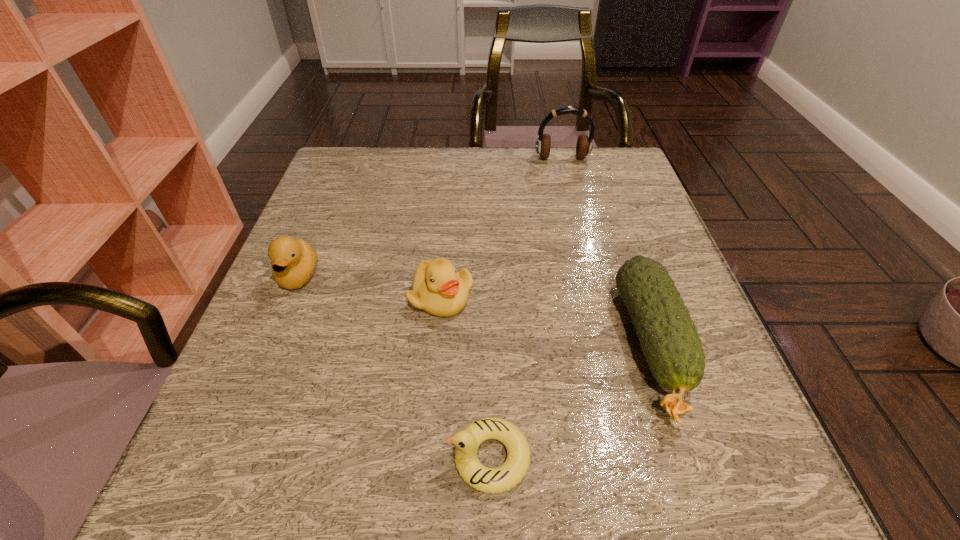
Where is `vacant space that is in between the tallest object and the leftmost object`? vacant space that is in between the tallest object and the leftmost object is located at coordinates (431, 218).

Image resolution: width=960 pixels, height=540 pixels. In order to click on object that is the fourth nearest to the cucumber in this screenshot , I will do `click(293, 261)`.

Locate which object ranks third in proximity to the leftmost object. Please provide its 2D coordinates. Your answer should be formatted as a tuple, i.e. [(x, y)], where the tuple contains the x and y coordinates of a point satisfying the conditions above.

[(669, 340)]

Locate which duckling is the closest to the shortest object. Please provide its 2D coordinates. Your answer should be formatted as a tuple, i.e. [(x, y)], where the tuple contains the x and y coordinates of a point satisfying the conditions above.

[(438, 289)]

The height and width of the screenshot is (540, 960). I want to click on the second closest duckling to the headset, so click(293, 261).

Image resolution: width=960 pixels, height=540 pixels. Identify the location of blank space that satisfies the following two spatial constraints: 1. at the blossom end of the cucumber; 2. on the face of the nearest duckling. pyautogui.click(x=691, y=457).

At what (x,y) coordinates should I click in order to perform the action: click on free space in the image that satisfies the following two spatial constraints: 1. on the ear cup of the farthest object; 2. on the face of the shortest duckling. Please return your answer as a coordinate pair (x, y). Image resolution: width=960 pixels, height=540 pixels. Looking at the image, I should click on (638, 457).

Locate an element on the screen. This screenshot has width=960, height=540. free location that satisfies the following two spatial constraints: 1. on the ear cup of the headset; 2. on the face of the shortest object is located at coordinates (638, 457).

At what (x,y) coordinates should I click in order to perform the action: click on free space that satisfies the following two spatial constraints: 1. on the ear cup of the farthest object; 2. on the face of the shortest duckling. Please return your answer as a coordinate pair (x, y). The width and height of the screenshot is (960, 540). Looking at the image, I should click on (638, 457).